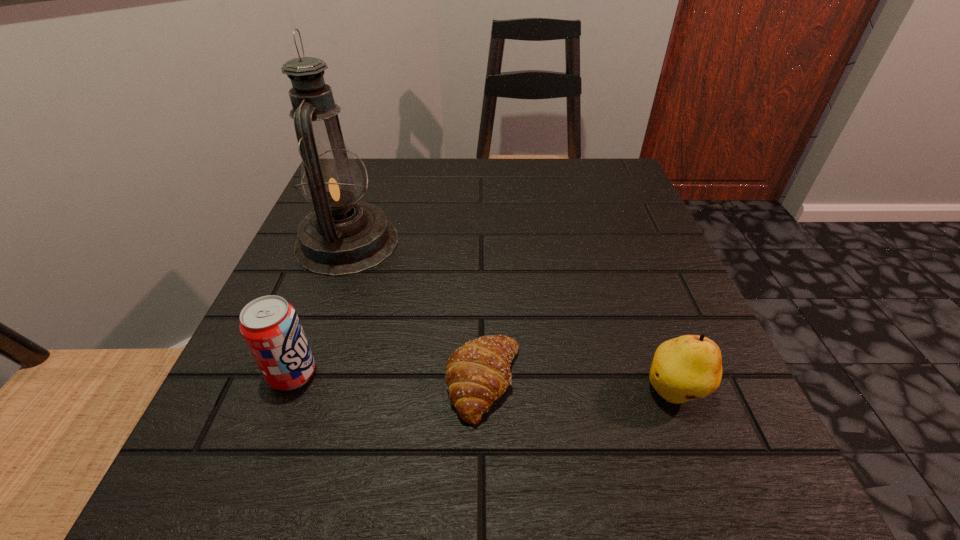
This screenshot has width=960, height=540. Find the location of `free space between the shortest object and the soda can`. free space between the shortest object and the soda can is located at coordinates (388, 378).

Where is `unoccupied position between the rightmost object and the tallest object`? unoccupied position between the rightmost object and the tallest object is located at coordinates (511, 318).

Image resolution: width=960 pixels, height=540 pixels. I want to click on free space between the soda can and the second object from right to left, so click(388, 378).

The image size is (960, 540). Find the location of `free area in between the tallest object and the shortest object`. free area in between the tallest object and the shortest object is located at coordinates (416, 312).

Locate an element on the screen. The width and height of the screenshot is (960, 540). free space between the second object from right to left and the second shortest object is located at coordinates (579, 387).

The image size is (960, 540). I want to click on free space between the crescent roll and the soda can, so click(x=388, y=378).

The height and width of the screenshot is (540, 960). Identify the location of free space between the crescent roll and the oil lamp. (416, 312).

The width and height of the screenshot is (960, 540). What are the coordinates of `vacant region between the soda can and the farthest object` in the screenshot? It's located at (320, 308).

Identify the location of the third closest object relative to the soda can. (689, 367).

The height and width of the screenshot is (540, 960). In order to click on object that is the third closest to the tallest object in this screenshot , I will do `click(689, 367)`.